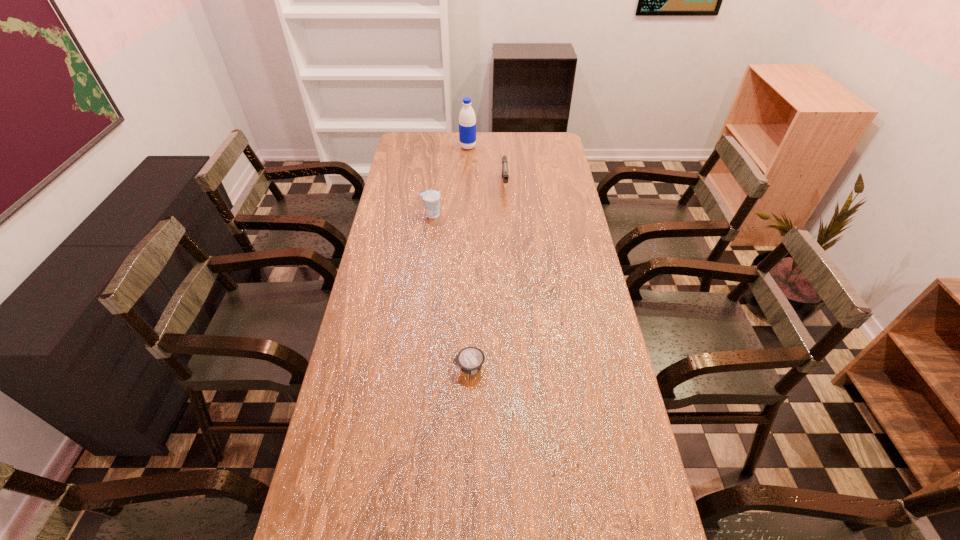
The width and height of the screenshot is (960, 540). I want to click on water bottle, so tap(467, 121).

Find the location of a particular element. Image resolution: width=960 pixels, height=540 pixels. the farthest object is located at coordinates (x=467, y=121).

Where is `the third nearest object`? the third nearest object is located at coordinates (505, 174).

At what (x,y) coordinates should I click in order to perform the action: click on gun. Please return your answer as a coordinate pair (x, y). The image size is (960, 540). Looking at the image, I should click on point(505,174).

This screenshot has height=540, width=960. Find the location of `the second nearest object`. the second nearest object is located at coordinates (431, 198).

The height and width of the screenshot is (540, 960). I want to click on the farther yogurt, so click(x=431, y=198).

Image resolution: width=960 pixels, height=540 pixels. Identify the location of the shortest object. (470, 359).

This screenshot has height=540, width=960. Identify the location of the nearer yogurt. (470, 359).

The height and width of the screenshot is (540, 960). What are the coordinates of `free location located on the front of the tallest object` in the screenshot? It's located at (467, 194).

Locate an element on the screen. blank area located in the direction the gun is aimed is located at coordinates [x=509, y=253].